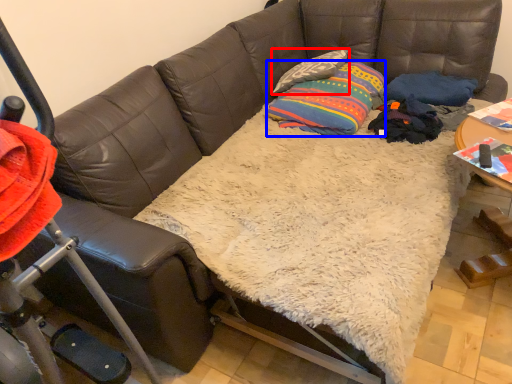
Question: Among these objects, which one is farthest to the camera, pillow (highlighted by a red box) or throw pillow (highlighted by a blue box)?

Choices:
 (A) pillow
 (B) throw pillow

Answer: (A)